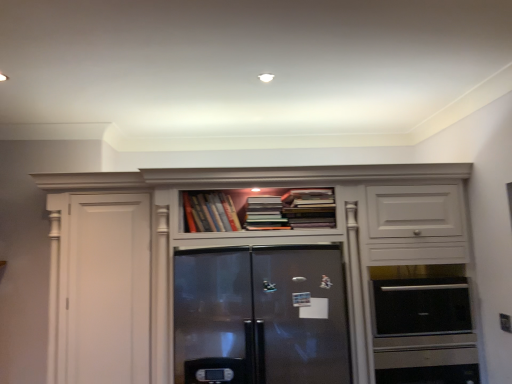
Question: From the image's perspective, is satin stainless steel refrigerator at center positioned above or below hardcover books at upper center, the first book positioned from the right?

Choices:
 (A) above
 (B) below

Answer: (B)

Question: Is satin stainless steel refrigerator at center situated inside hardcover books at upper center, the first book positioned from the right, or outside?

Choices:
 (A) outside
 (B) inside

Answer: (A)

Question: Which of these objects is positioned farthest from the hardcover books at center, arranged as the second book when viewed from the right?

Choices:
 (A) satin black oven at right
 (B) hardcover books at center, the third book when ordered from right to left
 (C) hardcover books at upper center, marked as the 3th book in a left-to-right arrangement
 (D) matte white cabinet at center
 (E) satin stainless steel refrigerator at center

Answer: (A)

Question: Estimate the real-world distances between objects in this image. Which object is closer to the satin black oven at right?

Choices:
 (A) hardcover books at center, acting as the first book starting from the left
 (B) hardcover books at upper center, marked as the 3th book in a left-to-right arrangement
 (C) matte white cabinet at center
 (D) hardcover books at center, arranged as the second book when viewed from the right
 (E) satin stainless steel refrigerator at center

Answer: (C)